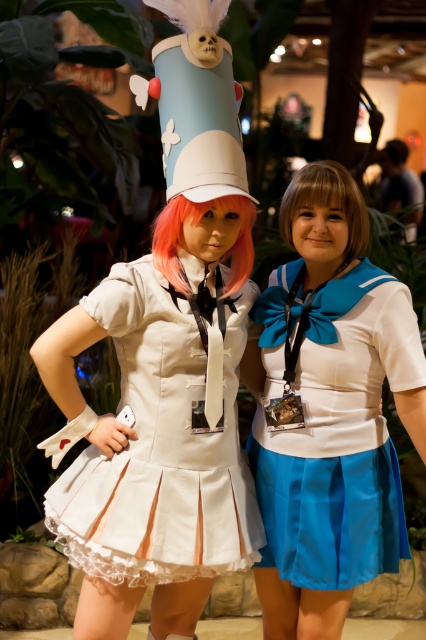
Between point (224, 419) and point (388, 476), which one is positioned behind?

The point (388, 476) is behind.

From the picture: Is white satin dress at center smaller than satin blue skirt at center?

No, white satin dress at center is not smaller than satin blue skirt at center.

Locate an element on the screen. white satin dress at center is located at coordinates (161, 445).